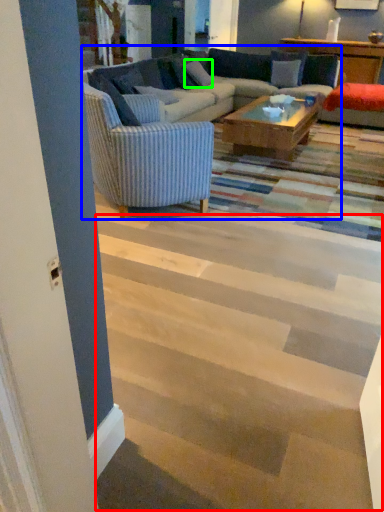
Question: Estimate the real-world distances between objects in this image. Which object is closer to stairwell (highlighted by a red box), studio couch (highlighted by a blue box) or pillow (highlighted by a green box)?

Choices:
 (A) studio couch
 (B) pillow

Answer: (A)